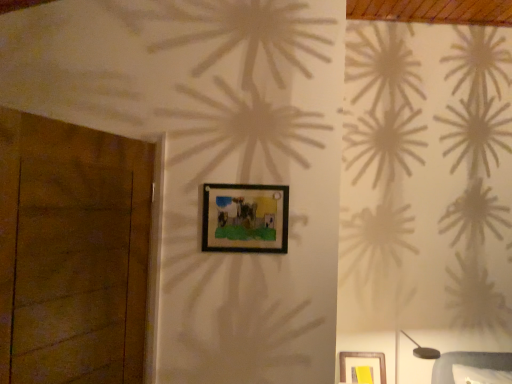
This screenshot has width=512, height=384. Describe the element at coordinates (245, 218) in the screenshot. I see `black matte picture frame at center` at that location.

I want to click on metallic gray table lamp at lower right, so pos(422,350).

Is metallic gray table lamp at lower right surrounded by black matte picture frame at center?

No, metallic gray table lamp at lower right is located outside of black matte picture frame at center.

From the picture: Is black matte picture frame at center next to metallic gray table lamp at lower right?

No, black matte picture frame at center is not with metallic gray table lamp at lower right.

Is point (257, 200) closer to viewer compared to point (414, 354)?

Yes, it is.

Does metallic gray table lamp at lower right have a smaller size compared to black matte picture frame at center?

No.

From the image's perspective, is metallic gray table lamp at lower right above or below black matte picture frame at center?

Clearly, from the image's perspective, metallic gray table lamp at lower right is below black matte picture frame at center.

Considering the positions of point (422, 359) and point (215, 231), is point (422, 359) closer or farther from the camera than point (215, 231)?

Point (422, 359) is positioned farther from the camera compared to point (215, 231).

How different are the orientations of metallic gray table lamp at lower right and black matte picture frame at center in degrees?

The facing directions of metallic gray table lamp at lower right and black matte picture frame at center are 3.84 degrees apart.

Who is shorter, black matte picture frame at center or brown wooden door at left?

Standing shorter between the two is black matte picture frame at center.

Based on their positions, is black matte picture frame at center located to the left or right of brown wooden door at left?

black matte picture frame at center is to the right of brown wooden door at left.

In the scene shown: From a real-world perspective, is black matte picture frame at center physically below brown wooden door at left?

No, from a real-world perspective, black matte picture frame at center is not below brown wooden door at left.

Is black matte picture frame at center oriented towards brown wooden door at left?

No, black matte picture frame at center is not oriented towards brown wooden door at left.

Is brown wooden door at left bigger or smaller than black matte picture frame at center?

Considering their sizes, brown wooden door at left takes up more space than black matte picture frame at center.

Is brown wooden door at left shorter than black matte picture frame at center?

In fact, brown wooden door at left may be taller than black matte picture frame at center.

Which object is positioned more to the right, brown wooden door at left or black matte picture frame at center?

black matte picture frame at center.

Is metallic gray table lamp at lower right looking in the opposite direction of brown wooden door at left?

metallic gray table lamp at lower right is not turned away from brown wooden door at left.

From a real-world perspective, which is physically below, metallic gray table lamp at lower right or brown wooden door at left?

From a 3D spatial view, metallic gray table lamp at lower right is below.

Between point (420, 350) and point (85, 217), which one is positioned in front?

The point (85, 217) is in front.

Is brown wooden door at left far from metallic gray table lamp at lower right?

brown wooden door at left is far away from metallic gray table lamp at lower right.

Based on the photo, can you confirm if brown wooden door at left is thinner than metallic gray table lamp at lower right?

Yes, brown wooden door at left is thinner than metallic gray table lamp at lower right.

From the image's perspective, relative to metallic gray table lamp at lower right, is brown wooden door at left above or below?

brown wooden door at left is above metallic gray table lamp at lower right.

From a real-world perspective, relative to metallic gray table lamp at lower right, is brown wooden door at left vertically above or below?

brown wooden door at left is situated higher than metallic gray table lamp at lower right in the real world.

You are a GUI agent. You are given a task and a screenshot of the screen. Output one action in this format:
    pyautogui.click(x=<x>, y=<y>)
    Task: Click on the picture frame lying on the left of metallic gray table lamp at lower right
    The height and width of the screenshot is (384, 512).
    Given the screenshot: What is the action you would take?
    pyautogui.click(x=245, y=218)

I want to click on picture frame located in front of the metallic gray table lamp at lower right, so click(x=245, y=218).

Based on the photo, from the image, which object appears to be nearer to black matte picture frame at center, brown wooden door at left or metallic gray table lamp at lower right?

brown wooden door at left.

Looking at the image, which one is located closer to brown wooden door at left, black matte picture frame at center or metallic gray table lamp at lower right?

black matte picture frame at center is closer to brown wooden door at left.

From the image, which object appears to be farther from metallic gray table lamp at lower right, black matte picture frame at center or brown wooden door at left?

Among the two, brown wooden door at left is located further to metallic gray table lamp at lower right.

Estimate the real-world distances between objects in this image. Which object is closer to metallic gray table lamp at lower right, brown wooden door at left or black matte picture frame at center?

Based on the image, black matte picture frame at center appears to be nearer to metallic gray table lamp at lower right.

From the image, which object appears to be nearer to brown wooden door at left, metallic gray table lamp at lower right or black matte picture frame at center?

Among the two, black matte picture frame at center is located nearer to brown wooden door at left.

Considering their positions, is metallic gray table lamp at lower right positioned closer to black matte picture frame at center than brown wooden door at left?

The object closer to black matte picture frame at center is brown wooden door at left.

Locate an element on the screen. The width and height of the screenshot is (512, 384). picture frame between brown wooden door at left and metallic gray table lamp at lower right is located at coordinates (245, 218).